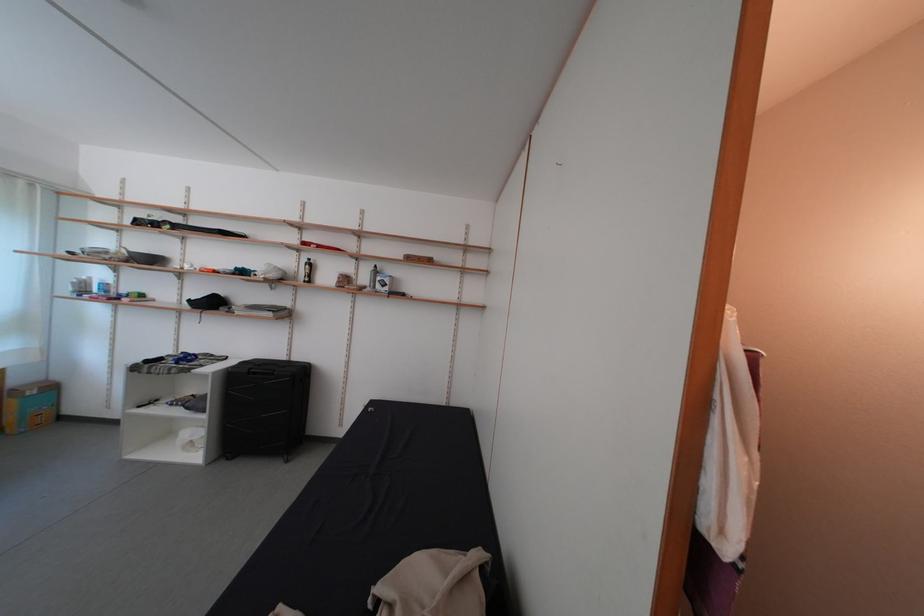
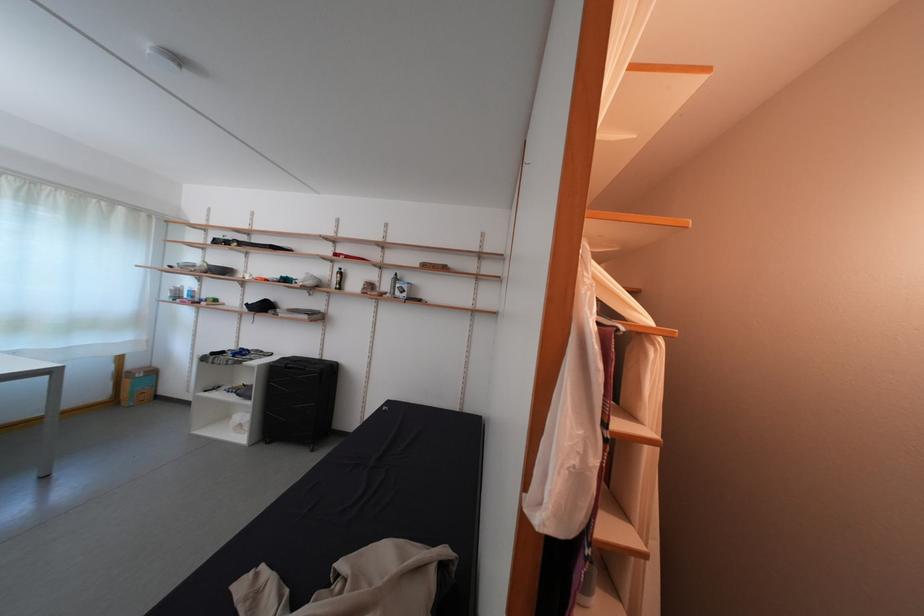
In the second image, find the point that corresponds to [307,278] in the first image.

(339, 286)